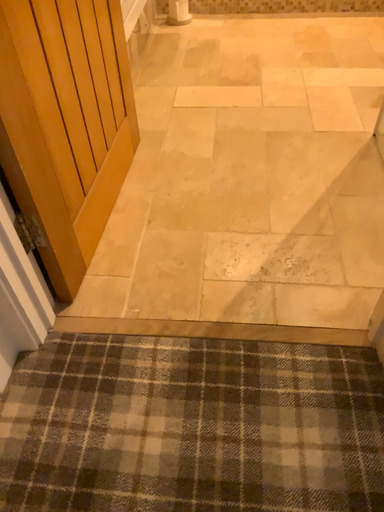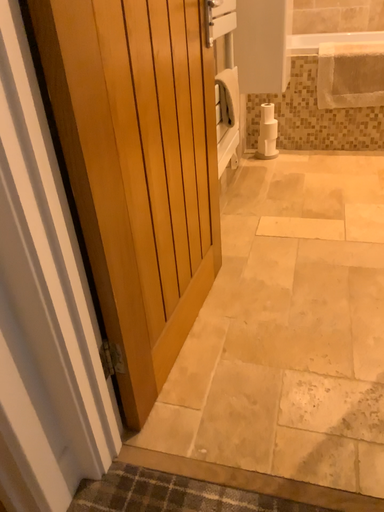
Question: Which way did the camera rotate in the video?

Choices:
 (A) rotated downward
 (B) rotated upward

Answer: (B)